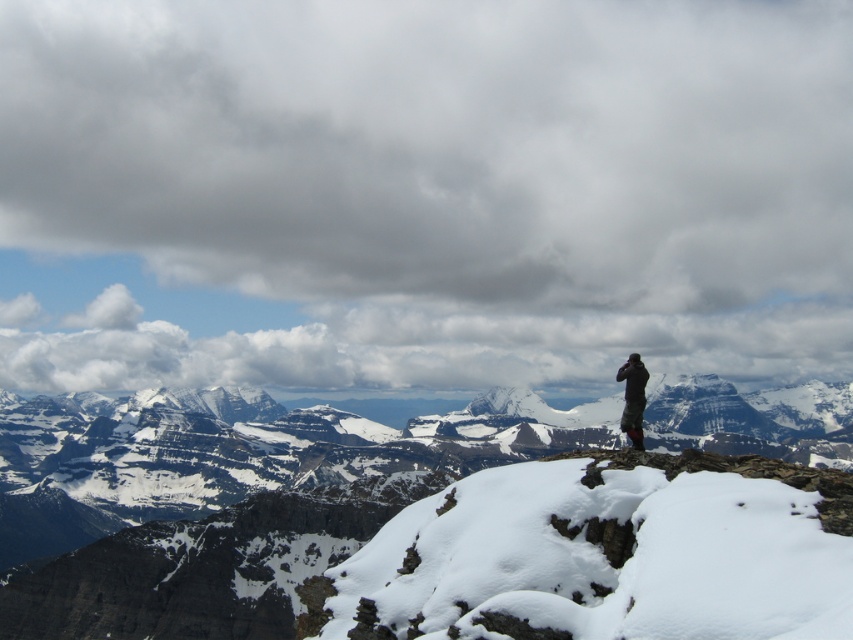
You are a hiker planning to traverse the snowy rocky mountain at center. From your current position, which object in the image would block your view of the cloudy sky at upper center once you start ascending the mountain?

The snowy rocky mountain at center would block your view of the cloudy sky at upper center because it is positioned in front of the sky in the image.

You are a hiker planning to traverse the mountain path between the two points marked as point (x=547, y=328) and point (x=630, y=435). Which point should you start from if you want to hike uphill first?

You should start from point (x=630, y=435) because point (x=547, y=328) is behind it, indicating that it is higher in elevation. Hiking uphill first would mean beginning at the lower point and moving towards the higher one.

You are a hiker planning to traverse the mountain path between point A at point (171, 436) and point B at point (633, 428). Based on the image, which point is closer to your current position as you start your hike?

Point A at point (171, 436) is closer to your current position because it is further to the viewer than point B at point (633, 428).